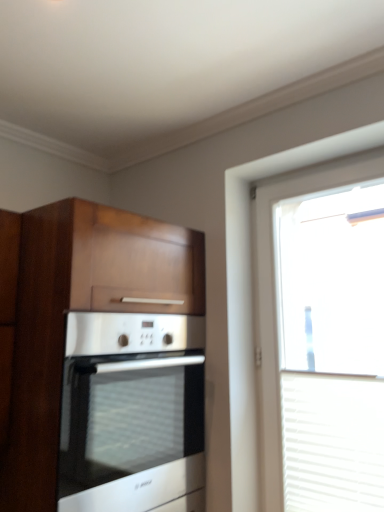
Question: Does transparent glass window at right appear on the left side of wooden cabinet at left?

Choices:
 (A) no
 (B) yes

Answer: (A)

Question: Is transparent glass window at right shorter than wooden cabinet at left?

Choices:
 (A) no
 (B) yes

Answer: (A)

Question: From the image's perspective, is transparent glass window at right beneath wooden cabinet at left?

Choices:
 (A) yes
 (B) no

Answer: (B)

Question: Does transparent glass window at right have a lesser width compared to wooden cabinet at left?

Choices:
 (A) yes
 (B) no

Answer: (A)

Question: From the image's perspective, is transparent glass window at right on wooden cabinet at left?

Choices:
 (A) yes
 (B) no

Answer: (A)

Question: From a real-world perspective, is transparent glass window at right under wooden cabinet at left?

Choices:
 (A) no
 (B) yes

Answer: (A)

Question: Is wooden cabinet at left next to satin silver oven at center?

Choices:
 (A) no
 (B) yes

Answer: (B)

Question: Is wooden cabinet at left to the right of satin silver oven at center from the viewer's perspective?

Choices:
 (A) no
 (B) yes

Answer: (A)

Question: Is wooden cabinet at left not close to satin silver oven at center?

Choices:
 (A) no
 (B) yes

Answer: (A)

Question: Is wooden cabinet at left oriented away from satin silver oven at center?

Choices:
 (A) yes
 (B) no

Answer: (A)

Question: Can you confirm if wooden cabinet at left is smaller than satin silver oven at center?

Choices:
 (A) yes
 (B) no

Answer: (B)

Question: Considering the relative sizes of wooden cabinet at left and satin silver oven at center in the image provided, is wooden cabinet at left taller than satin silver oven at center?

Choices:
 (A) yes
 (B) no

Answer: (A)

Question: Does satin silver oven at center appear on the left side of wooden cabinet at left?

Choices:
 (A) yes
 (B) no

Answer: (B)